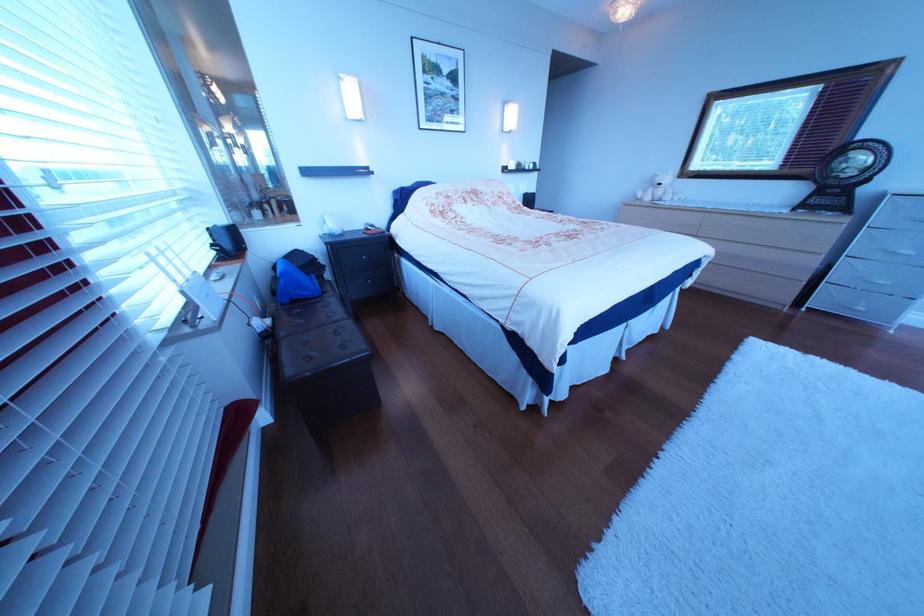
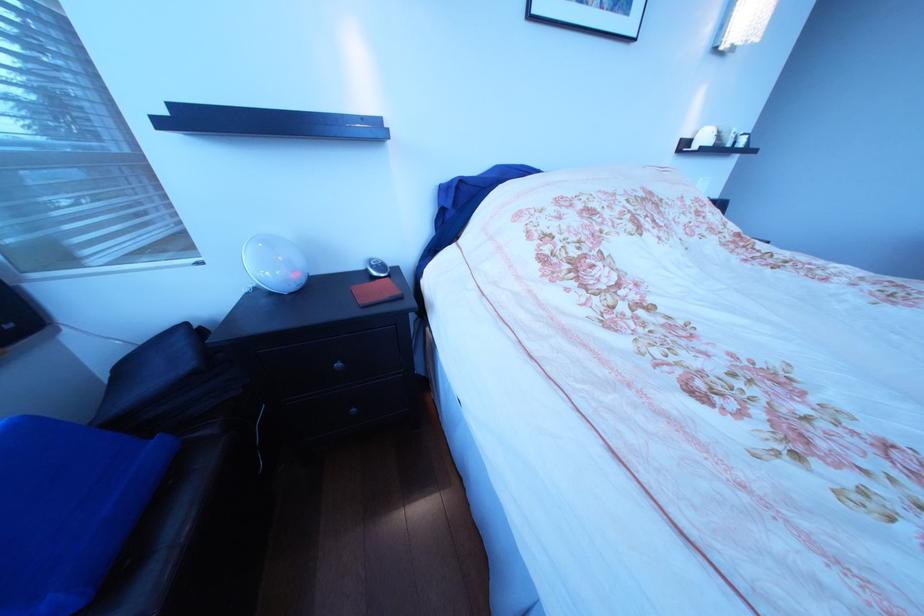
Locate, in the second image, the point that corresponds to pixel 383 228 in the first image.

(387, 268)